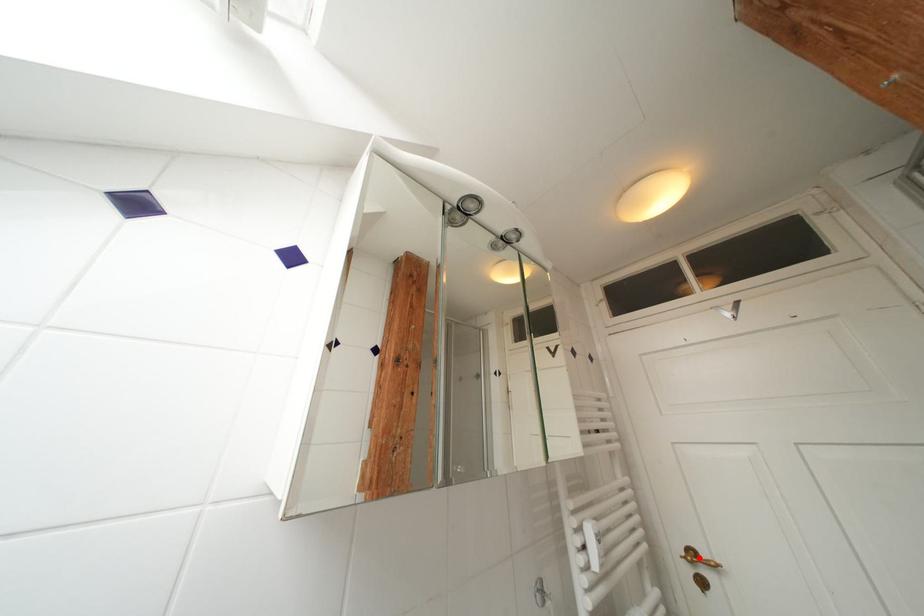
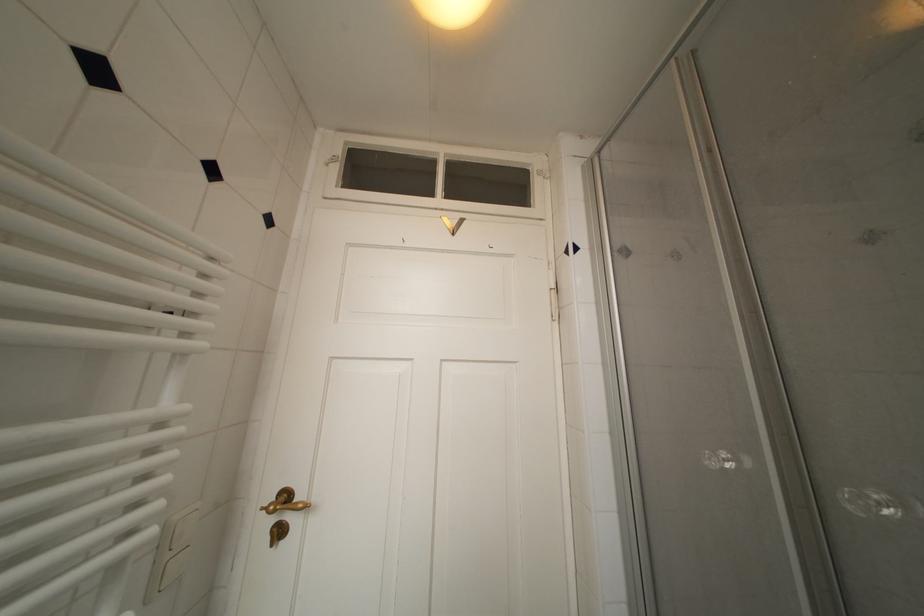
Find the pixel in the second image that matches the highlighted location in the first image.

(293, 500)